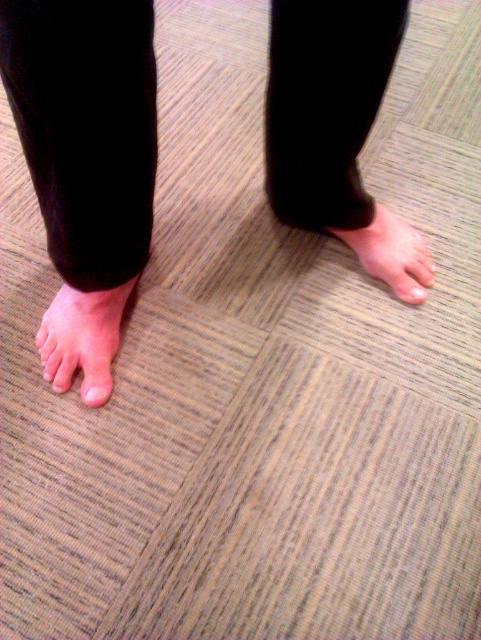
Question: Can you confirm if skinny bare feet at center is positioned below pink flesh-toned foot at lower left?

Choices:
 (A) yes
 (B) no

Answer: (B)

Question: In this image, where is pink skin at center located relative to pale skin toe at center?

Choices:
 (A) above
 (B) below

Answer: (A)

Question: Which object appears farthest from the camera in this image?

Choices:
 (A) pale skin toe at center
 (B) pink skin at center
 (C) white matte toe at lower left

Answer: (B)

Question: Which object is farther from the camera taking this photo?

Choices:
 (A) white matte toe at lower left
 (B) pink skin at center
 (C) pink flesh-toned foot at lower left

Answer: (B)

Question: Which object is closer to the camera taking this photo?

Choices:
 (A) pink skin at center
 (B) pink flesh-toned foot at lower left
 (C) skinny bare feet at center

Answer: (C)

Question: Is skinny bare feet at center above pink skin at center?

Choices:
 (A) no
 (B) yes

Answer: (B)